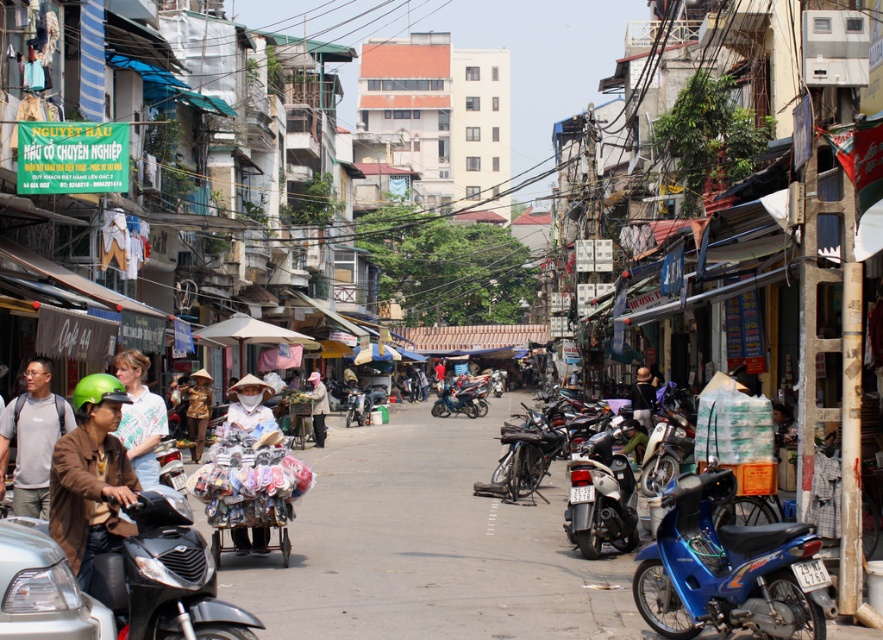
You are a delivery person who needs to load a package onto the light brown fabric cart at center. The package requires a space that is taller than the green matte helmet at left. Is the cart at center tall enough?

The light brown fabric cart at center is taller than the green matte helmet at left, so yes, the cart at center has sufficient height to accommodate the package.

You are standing on the street and want to take a photo that includes both the point at coordinates (122, 420) and the point at (248, 408). Which point should you focus on to ensure both are in sharp focus?

You should focus on the point at (122, 420) because it is closer to the camera and focusing on the closer object will ensure both are in focus due to the depth of field.

You are a delivery person who just arrived at this street and need to pick up your green matte helmet at left. Where exactly should you look to find it?

The green matte helmet at left is located at the coordinates point [91,477].